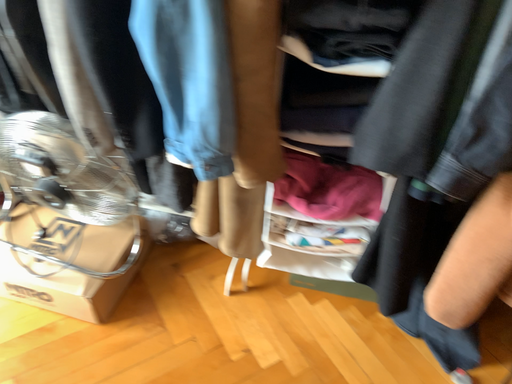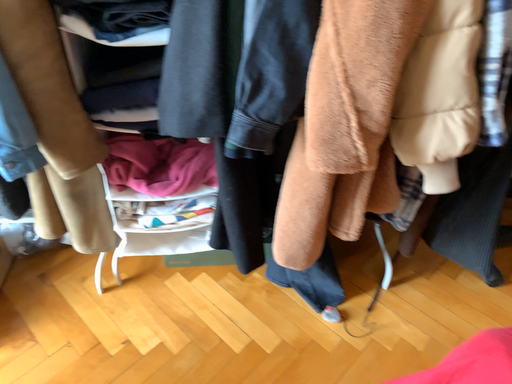
Question: How did the camera likely rotate when shooting the video?

Choices:
 (A) rotated left
 (B) rotated right

Answer: (B)